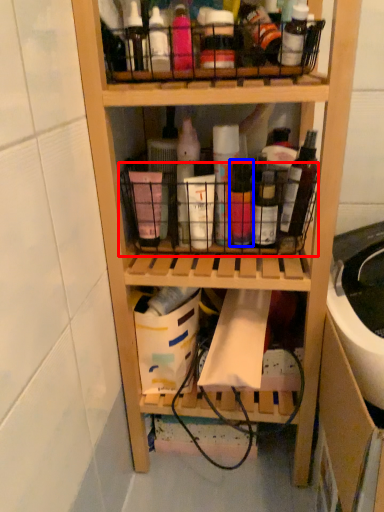
Question: Among these objects, which one is nearest to the camera, basket (highlighted by a red box) or bottle (highlighted by a blue box)?

Choices:
 (A) basket
 (B) bottle

Answer: (B)